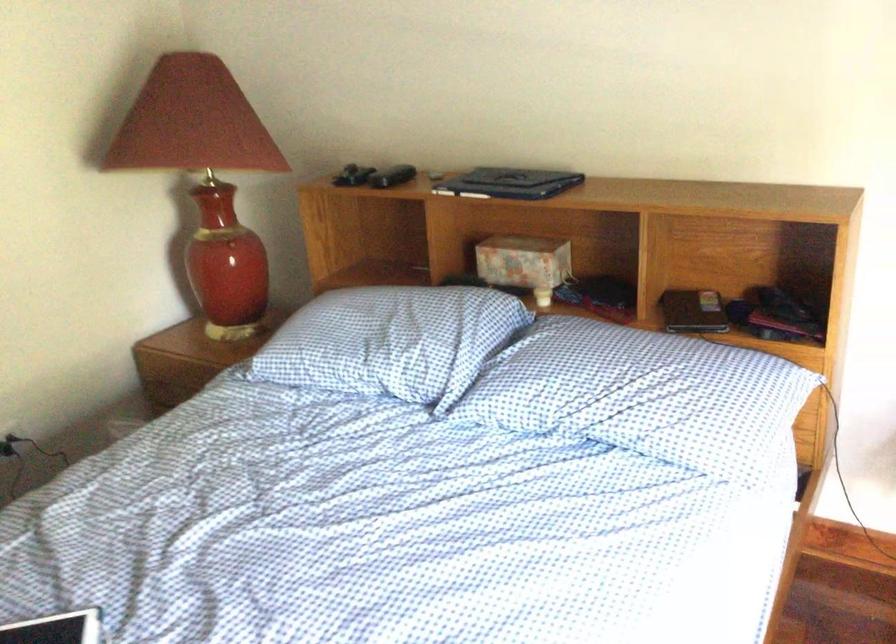
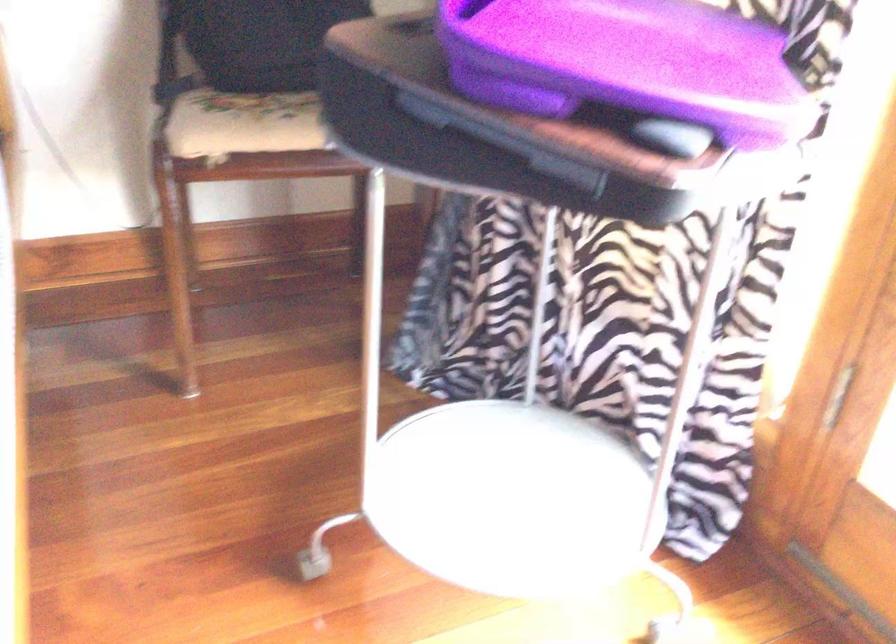
Question: The camera is either moving clockwise (left) or counter-clockwise (right) around the object. The first image is from the beginning of the video and the second image is from the end. Is the camera moving left or right when shooting the video?

Choices:
 (A) Left
 (B) Right

Answer: (A)